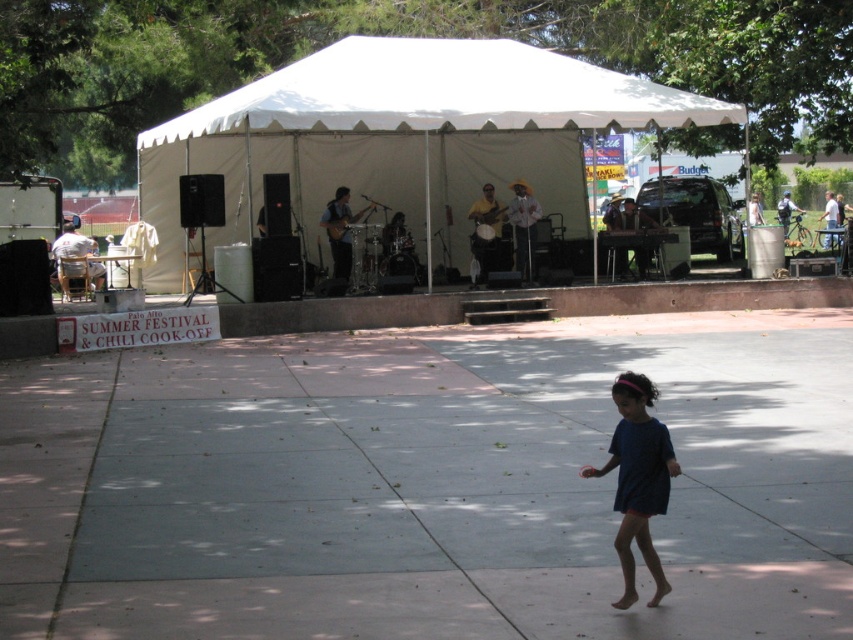
Who is shorter, gray concrete pavement at lower center or white fabric canopy at upper center?

gray concrete pavement at lower center is shorter.

Who is lower down, gray concrete pavement at lower center or white fabric canopy at upper center?

gray concrete pavement at lower center is lower down.

What are the coordinates of `gray concrete pavement at lower center` in the screenshot? It's located at (x=427, y=483).

This screenshot has height=640, width=853. Find the location of `gray concrete pavement at lower center`. gray concrete pavement at lower center is located at coordinates (427, 483).

In the scene shown: Does white canvas tent at center come in front of white fabric canopy at upper center?

Yes.

Based on the photo, measure the distance from white canvas tent at center to white fabric canopy at upper center.

15.36 inches

Measure the distance between white canvas tent at center and camera.

They are 55.60 feet apart.

Where is `white canvas tent at center`? white canvas tent at center is located at coordinates (404, 136).

Between white fabric canopy at upper center and blue fabric dress at lower center, which one has less height?

blue fabric dress at lower center

Is white fabric canopy at upper center wider than blue fabric dress at lower center?

Indeed, white fabric canopy at upper center has a greater width compared to blue fabric dress at lower center.

I want to click on white fabric canopy at upper center, so click(442, 93).

At what (x,y) coordinates should I click in order to perform the action: click on white fabric canopy at upper center. Please return your answer as a coordinate pair (x, y). The width and height of the screenshot is (853, 640). Looking at the image, I should click on (442, 93).